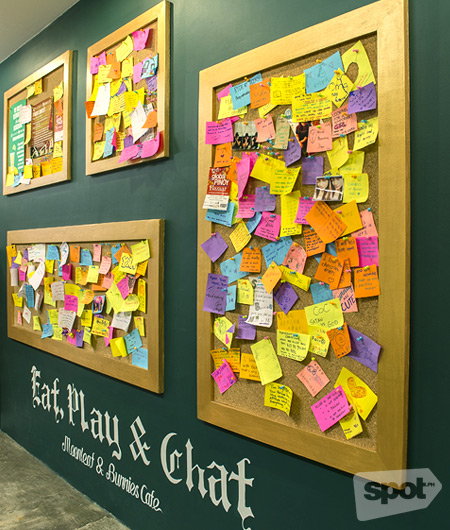
In order to click on words on wall in this screenshot , I will do `click(43, 394)`, `click(100, 425)`, `click(178, 464)`, `click(79, 458)`, `click(125, 485)`, `click(149, 494)`.